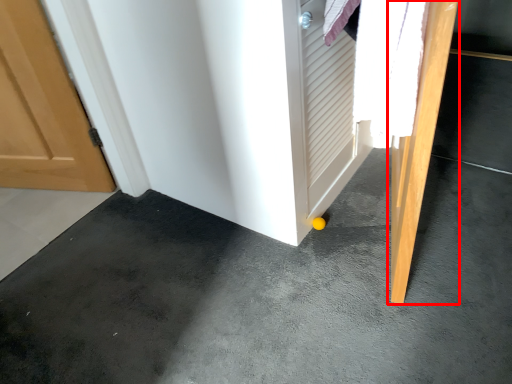
Question: From the image's perspective, where is door (annotated by the red box) located in relation to concrete in the image?

Choices:
 (A) below
 (B) above

Answer: (B)